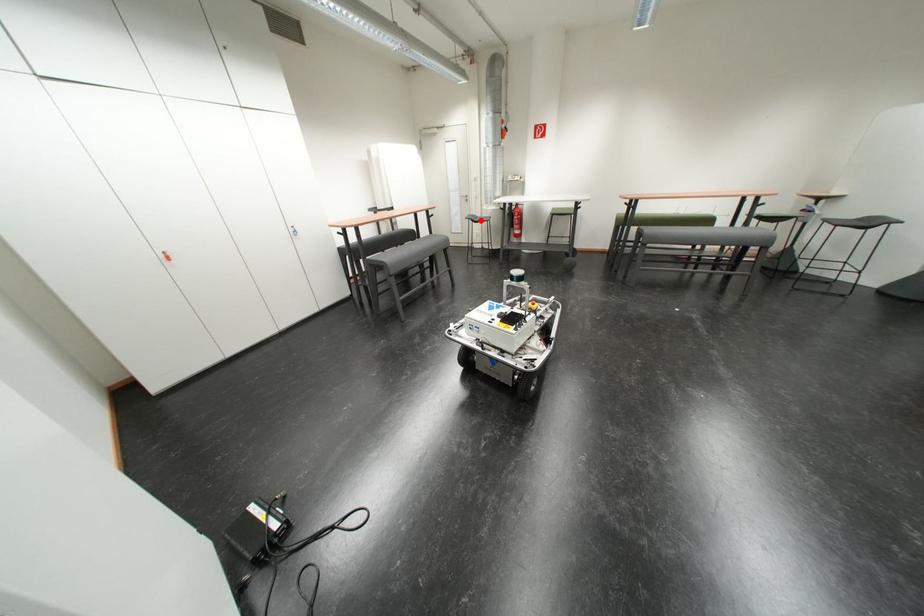
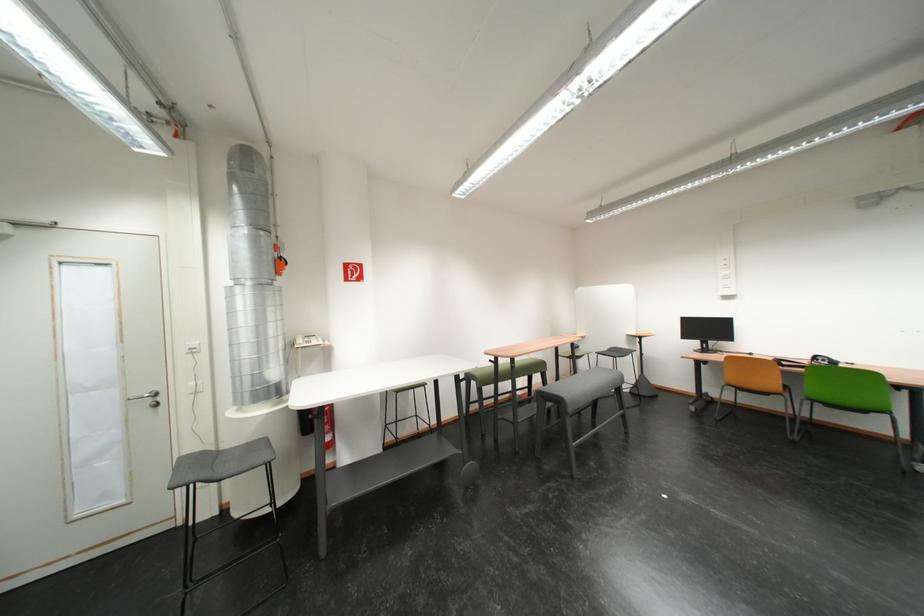
Find the pixel in the second image that matches the highlighted location in the first image.

(203, 480)